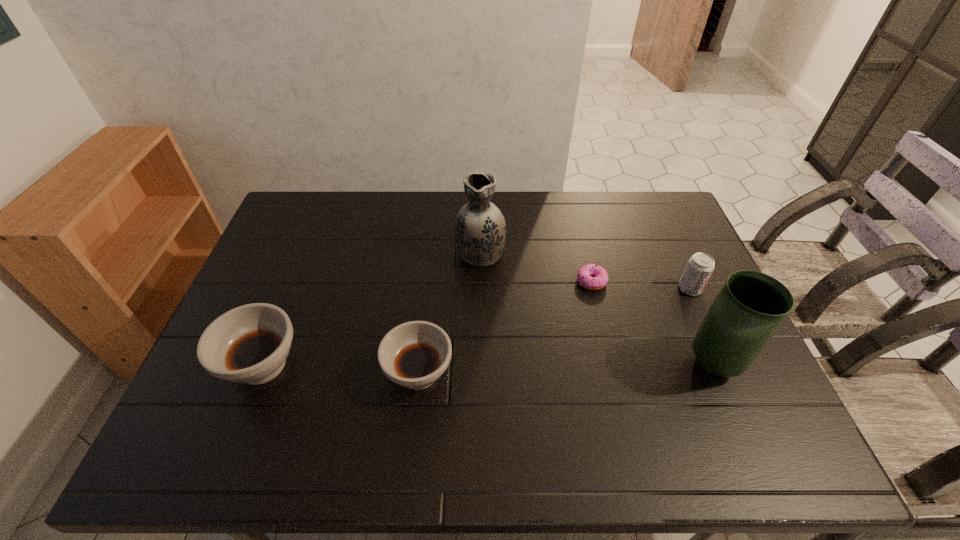
Where is `vase at the right edge`? vase at the right edge is located at coordinates (751, 306).

This screenshot has width=960, height=540. Find the location of `soda can located at the right edge`. soda can located at the right edge is located at coordinates (700, 266).

Locate an element on the screen. This screenshot has width=960, height=540. object that is at the near left corner is located at coordinates (249, 344).

The width and height of the screenshot is (960, 540). In order to click on object that is at the near right corner in this screenshot , I will do `click(751, 306)`.

You are a GUI agent. You are given a task and a screenshot of the screen. Output one action in this format:
    pyautogui.click(x=<x>, y=<y>)
    Task: Click on the vacant space at the far edge of the desktop
    
    Given the screenshot: What is the action you would take?
    pyautogui.click(x=514, y=211)

Identify the location of vacant region at the near edge. This screenshot has width=960, height=540. (340, 408).

Where is `free location at the right edge`? This screenshot has width=960, height=540. free location at the right edge is located at coordinates (693, 309).

Identify the location of vacant space at the far left corner of the desktop. (308, 192).

This screenshot has height=540, width=960. Find the location of `blank area at the near left corner`. blank area at the near left corner is located at coordinates (215, 391).

This screenshot has height=540, width=960. Identify the location of vacant space in between the shorter soup bowl and the farther vase. (449, 312).